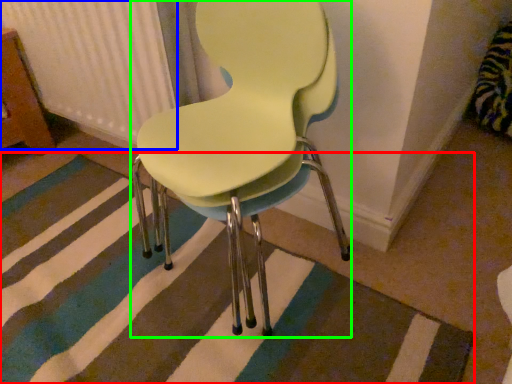
Question: Which is nearer to the doormat (highlighted by a red box)? radiator (highlighted by a blue box) or chair (highlighted by a green box).

Choices:
 (A) radiator
 (B) chair

Answer: (B)